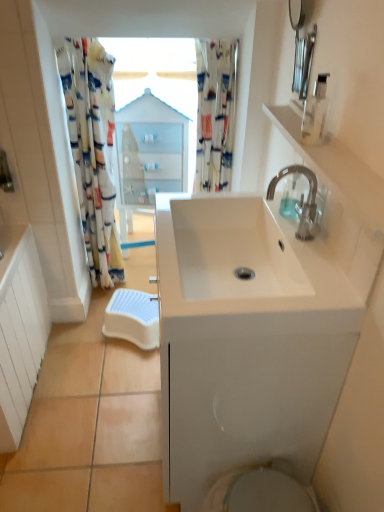
Question: From the image's perspective, is silver metallic faucet at upper right above or below transparent plastic soap dispenser at upper right, arranged as the 2th soap dispenser when ordered from the bottom?

Choices:
 (A) below
 (B) above

Answer: (A)

Question: Looking at their shapes, would you say silver metallic faucet at upper right is wider or thinner than transparent plastic soap dispenser at upper right, the 1th soap dispenser in the front-to-back sequence?

Choices:
 (A) wide
 (B) thin

Answer: (A)

Question: Which is farther from the printed fabric shower curtain at upper center, which ranks as the 1th shower curtain in right-to-left order?

Choices:
 (A) clear plastic soap dispenser at upper right, marked as the 1th soap dispenser in a back-to-front arrangement
 (B) white glossy sink at center
 (C) silver metallic faucet at upper right
 (D) white plastic step stool at lower center
 (E) transparent plastic soap dispenser at upper right, the 1th soap dispenser in the front-to-back sequence

Answer: (D)

Question: Which is nearer to the transparent plastic soap dispenser at upper right, the 1th soap dispenser in the front-to-back sequence?

Choices:
 (A) floral fabric shower curtain at left, which appears as the second shower curtain when viewed from the right
 (B) white glossy sink at center
 (C) clear plastic soap dispenser at upper right, marked as the 1th soap dispenser in a back-to-front arrangement
 (D) white plastic step stool at lower center
 (E) white glossy cabinet at center

Answer: (C)